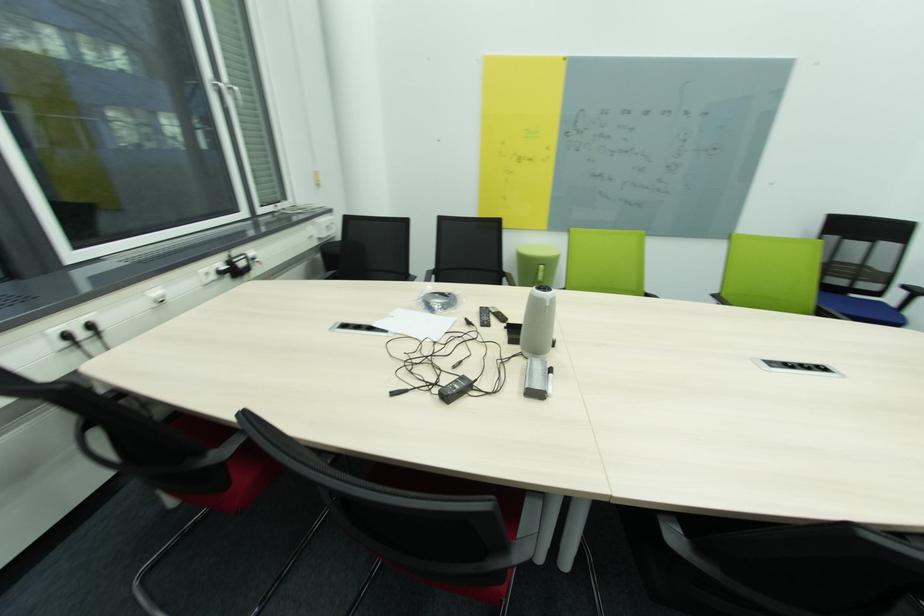
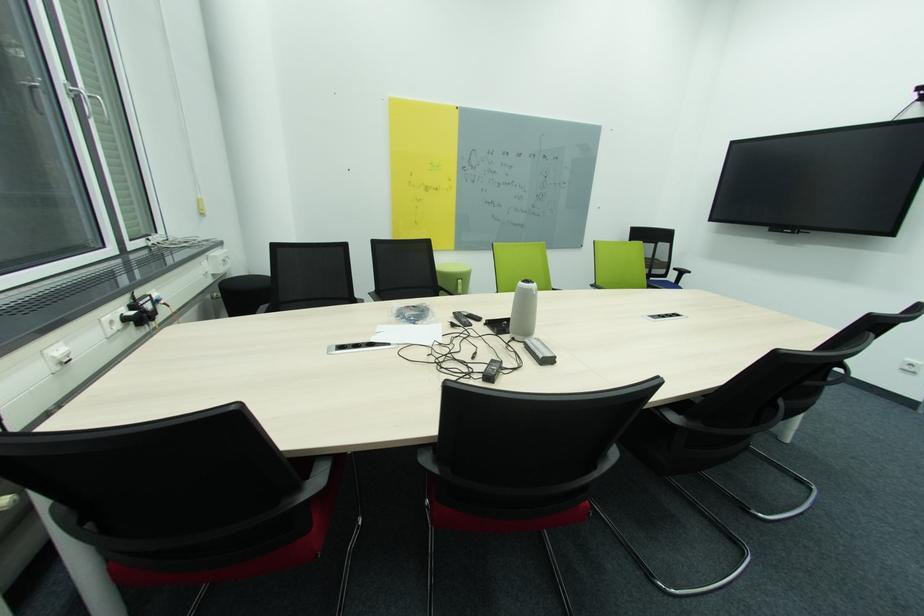
The point at (485, 309) is marked in the first image. Where is the corresponding point in the second image?

(458, 314)